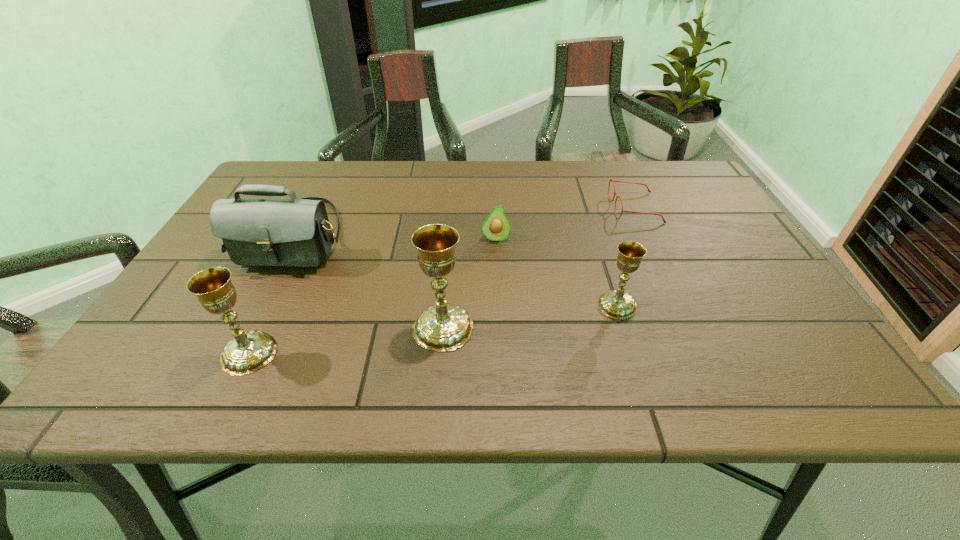
Where is `the leftmost chalice`? This screenshot has width=960, height=540. the leftmost chalice is located at coordinates [248, 352].

The height and width of the screenshot is (540, 960). I want to click on the tallest chalice, so click(x=444, y=327).

Where is `the second chalice from right to left`? The height and width of the screenshot is (540, 960). the second chalice from right to left is located at coordinates (444, 327).

Where is `the third shortest object`? the third shortest object is located at coordinates (617, 304).

I want to click on the rightmost chalice, so click(617, 304).

In order to click on spectacles in this screenshot , I will do `click(610, 180)`.

Where is `the rightmost object`? The width and height of the screenshot is (960, 540). the rightmost object is located at coordinates (610, 180).

Locate an element on the screen. The image size is (960, 540). the fourth object from left to right is located at coordinates (496, 227).

Identify the location of avocado. (496, 227).

The image size is (960, 540). What are the coordinates of `shoulder bag` in the screenshot? It's located at (296, 232).